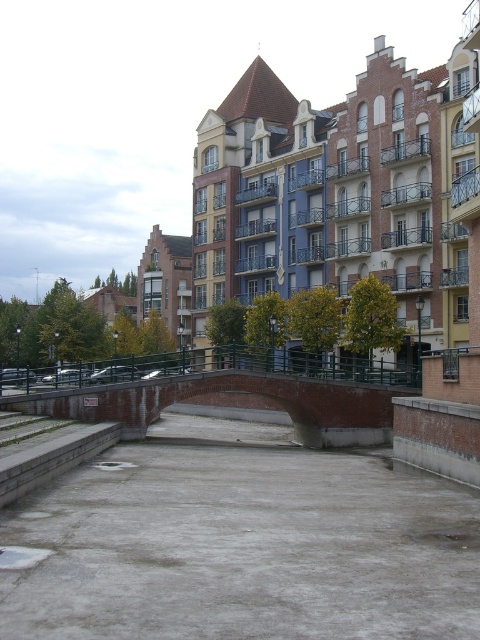
Question: Which of the following is the closest to the observer?

Choices:
 (A) brick bridge at center
 (B) gray concrete waterway at center

Answer: (B)

Question: Which point is closer to the camera?

Choices:
 (A) brick bridge at center
 (B) gray concrete waterway at center

Answer: (B)

Question: Is gray concrete waterway at center bigger than brick bridge at center?

Choices:
 (A) no
 (B) yes

Answer: (A)

Question: Which point is farther to the camera?

Choices:
 (A) brick bridge at center
 (B) gray concrete waterway at center

Answer: (A)

Question: Does gray concrete waterway at center have a larger size compared to brick bridge at center?

Choices:
 (A) yes
 (B) no

Answer: (B)

Question: Can you confirm if gray concrete waterway at center is thinner than brick bridge at center?

Choices:
 (A) no
 (B) yes

Answer: (B)